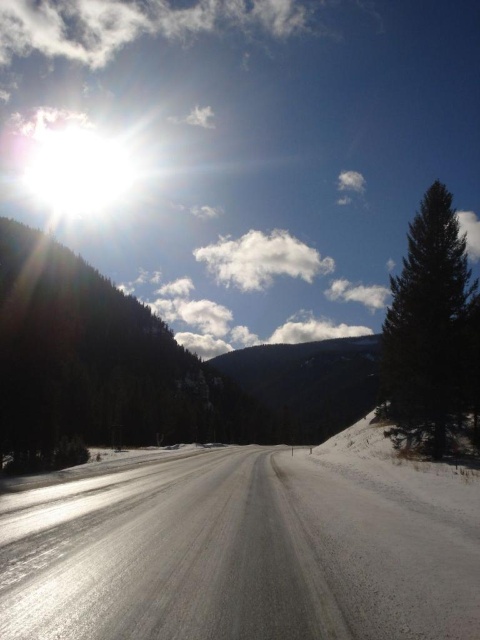
Question: Considering the real-world distances, which object is farthest from the dark green coniferous tree at right?

Choices:
 (A) green textured pine tree at left
 (B) white smooth road at center

Answer: (A)

Question: Which object is the closest to the dark green coniferous tree at right?

Choices:
 (A) green textured pine tree at left
 (B) white smooth road at center

Answer: (B)

Question: Is white smooth road at center behind green textured pine tree at left?

Choices:
 (A) yes
 (B) no

Answer: (B)

Question: Does green textured pine tree at left have a smaller size compared to dark green coniferous tree at right?

Choices:
 (A) yes
 (B) no

Answer: (B)

Question: In this image, where is white smooth road at center located relative to dark green coniferous tree at right?

Choices:
 (A) above
 (B) below

Answer: (B)

Question: Which point is closer to the camera?

Choices:
 (A) (17, 628)
 (B) (415, 381)

Answer: (A)